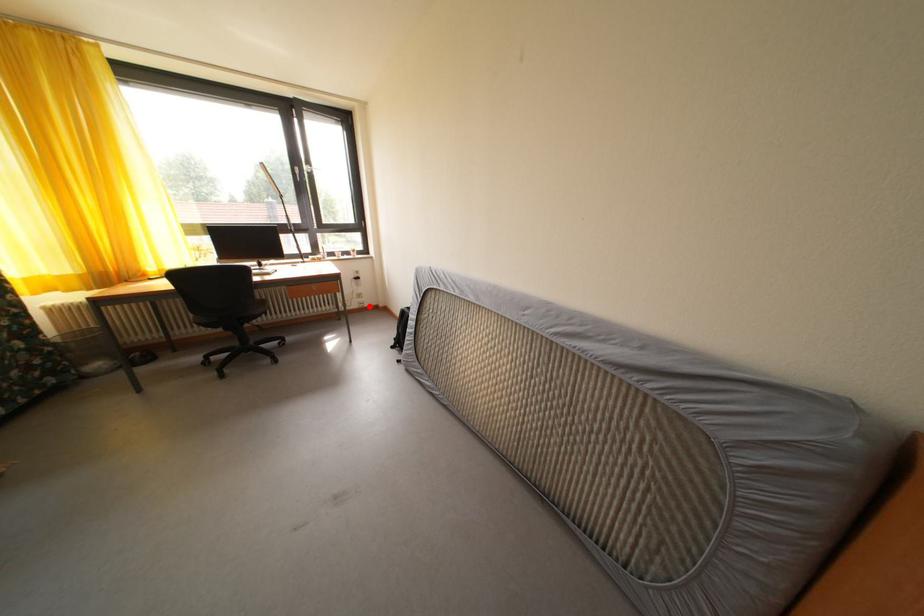
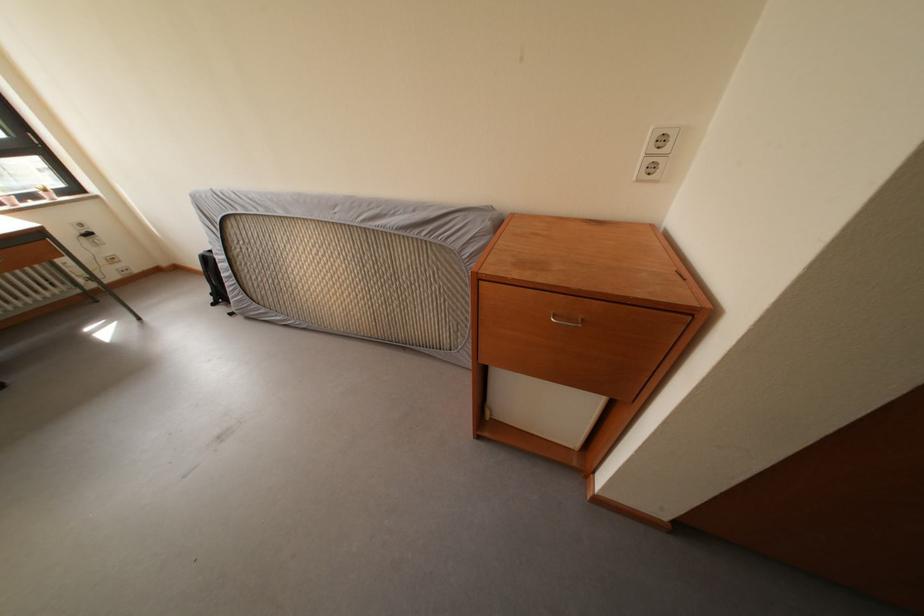
Find the pixel in the second image that matches the highlighted location in the first image.

(128, 273)